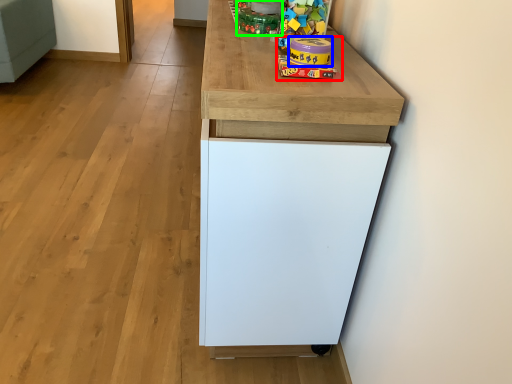
Question: Which is farther away from toy (highlighted by a red box)? toy (highlighted by a blue box) or toy (highlighted by a green box)?

Choices:
 (A) toy
 (B) toy

Answer: (B)